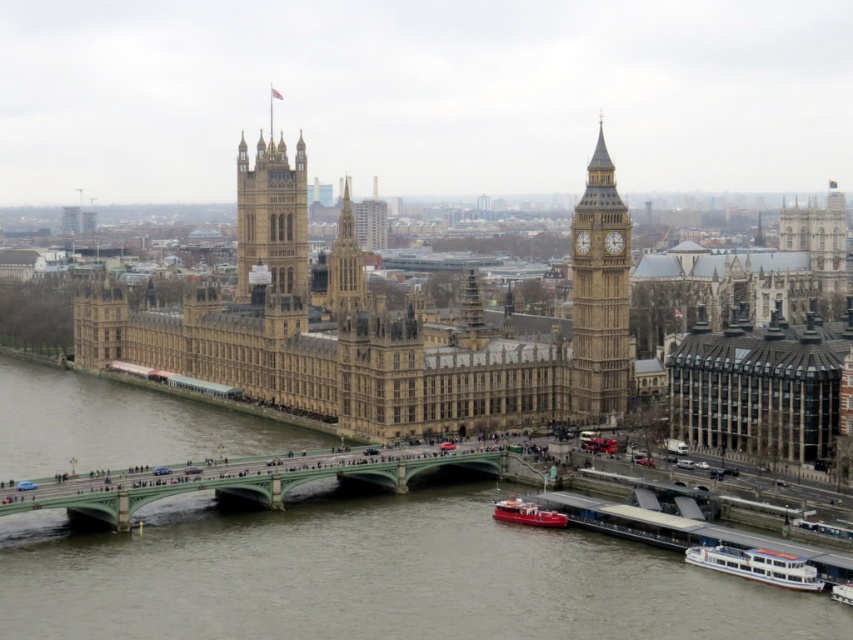
Does golden stone tower at center appear under white plastic boat at lower right?

Actually, golden stone tower at center is above white plastic boat at lower right.

Can you confirm if golden stone tower at center is taller than white plastic boat at lower right?

Indeed, golden stone tower at center has a greater height compared to white plastic boat at lower right.

Locate an element on the screen. The image size is (853, 640). golden stone tower at center is located at coordinates (271, 220).

Does golden stone tower at center have a smaller size compared to white glossy boat at lower right?

Actually, golden stone tower at center might be larger than white glossy boat at lower right.

Between point (276, 262) and point (721, 557), which one is positioned behind?

The point (276, 262) is behind.

Locate an element on the screen. golden stone tower at center is located at coordinates (271, 220).

Is green stone bridge at center bigger than metallic red boat at lower center?

Yes, green stone bridge at center is bigger than metallic red boat at lower center.

Is point (24, 509) positioned after point (537, 509)?

No.

This screenshot has height=640, width=853. Find the location of `green stone bridge at center`. green stone bridge at center is located at coordinates (234, 483).